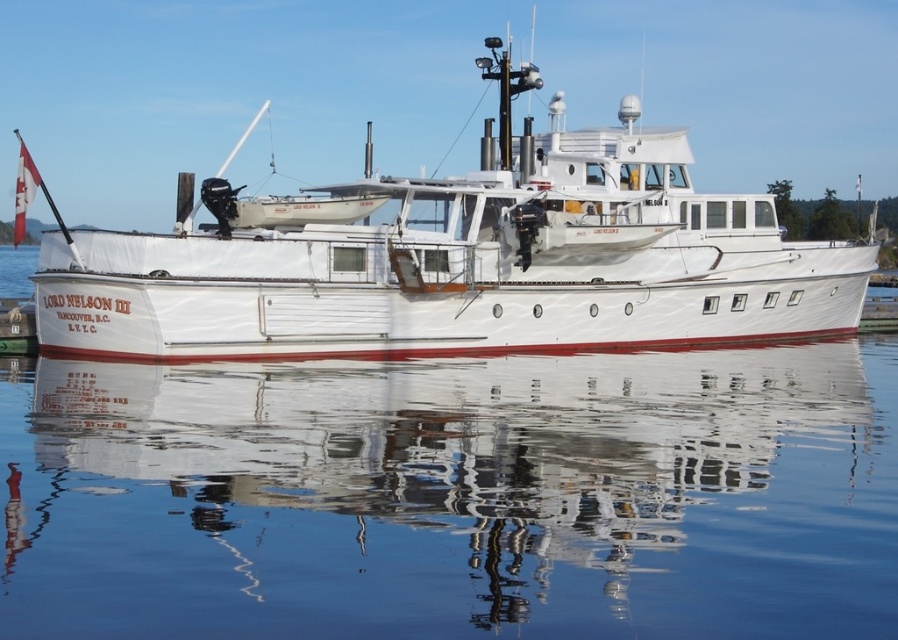
From the picture: Who is positioned more to the right, transparent water at center or white wooden boat at center?

Positioned to the right is transparent water at center.

Does transparent water at center appear over white wooden boat at center?

Incorrect, transparent water at center is not positioned above white wooden boat at center.

Does point (428, 544) come closer to viewer compared to point (606, 346)?

That is True.

Where is `transparent water at center`? The width and height of the screenshot is (898, 640). transparent water at center is located at coordinates (454, 497).